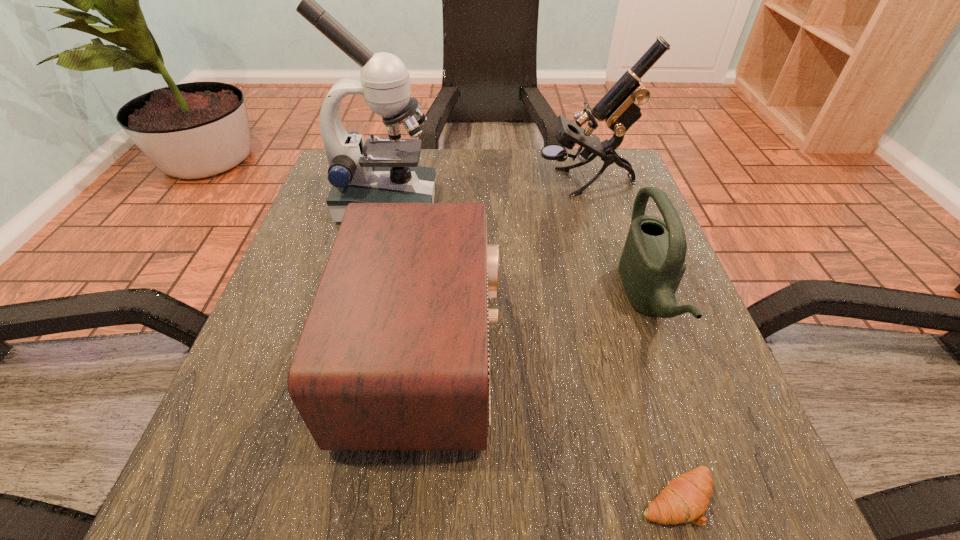
This screenshot has width=960, height=540. I want to click on microscope located at the right edge, so click(x=619, y=108).

Identify the location of watering can situated at the right edge. This screenshot has height=540, width=960. (652, 264).

This screenshot has height=540, width=960. I want to click on crescent roll at the right edge, so click(x=685, y=499).

Identify the location of object that is at the far left corner. The width and height of the screenshot is (960, 540). (383, 170).

The height and width of the screenshot is (540, 960). Identify the location of object present at the far right corner. (619, 108).

This screenshot has width=960, height=540. Find the location of `object that is positioned at the near right corner`. object that is positioned at the near right corner is located at coordinates (685, 499).

Find the location of a particular element. The image size is (960, 540). free space at the far edge of the desktop is located at coordinates (549, 195).

The width and height of the screenshot is (960, 540). What are the coordinates of `vacant space at the near edge` in the screenshot? It's located at (532, 492).

You are a GUI agent. You are given a task and a screenshot of the screen. Output one action in this format:
    pyautogui.click(x=<x>, y=<y>)
    Task: Click on the vacant region at the left edge
    Image resolution: width=960 pixels, height=540 pixels.
    Given the screenshot: What is the action you would take?
    pyautogui.click(x=311, y=306)

The width and height of the screenshot is (960, 540). Find the location of `free space at the right edge of the desktop`. free space at the right edge of the desktop is located at coordinates (718, 420).